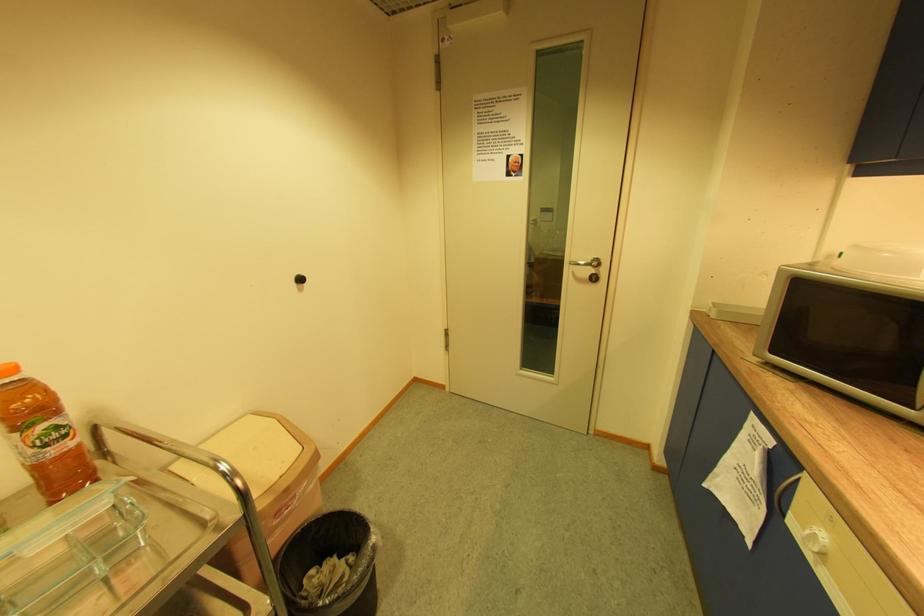
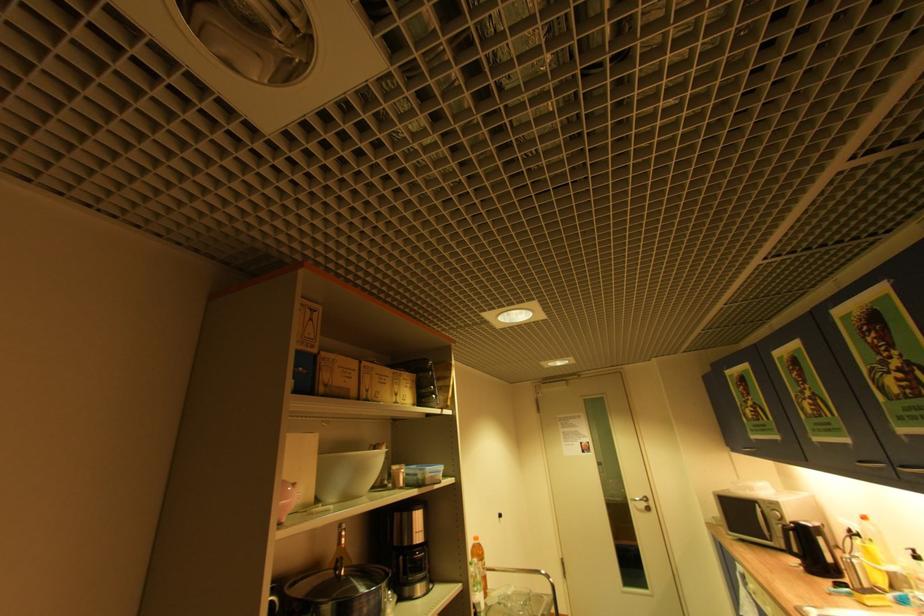
The point at (598, 272) is marked in the first image. Where is the corresponding point in the second image?

(650, 505)